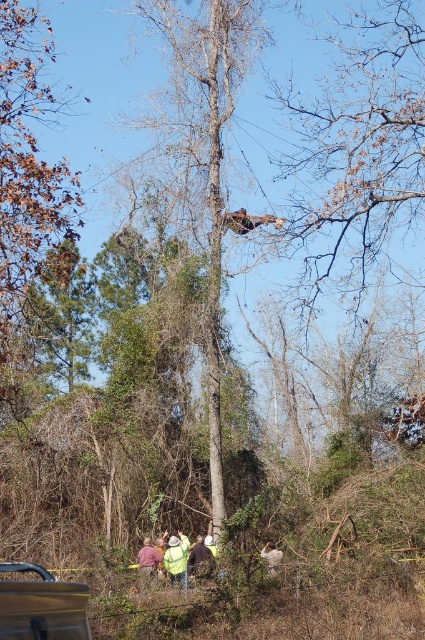
Looking at this image, you are a park ranger assessing a forest area. You notice the bare wood tree at center and the brown wood tree at upper left. Which tree would require more resources to remove due to its size?

The bare wood tree at center is bigger than the brown wood tree at upper left, so it would require more resources to remove due to its larger size.

From the picture: You are a safety inspector assessing the scene. You need to determine the location of the bare wood tree at center relative to the brown wood tree at upper left. Based on the image, which tree is positioned to the right of the other?

The bare wood tree at center is positioned on the right side of brown wood tree at upper left.

Based on the photo, you are a pedestrian standing at the edge of the scene. You see a metallic gray car at lower left and a yellow fabric shirt at center. Which object is closer to you?

The metallic gray car at lower left is positioned over yellow fabric shirt at center, so it is closer to you.